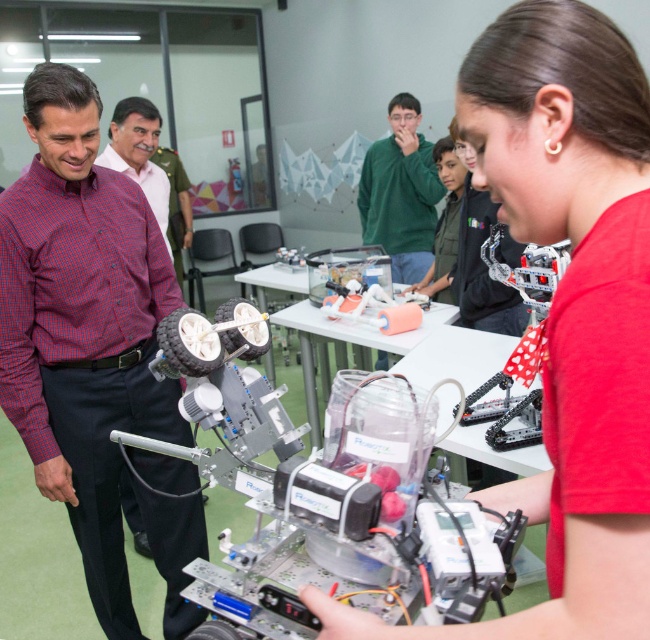
From the picture: You are a visitor observing the robotics activity. You notice two people in the scene wearing the red checkered shirt at left and the green matte sweater at center. Which person is closer to the robot?

The red checkered shirt at left is shorter than the green matte sweater at center, so the person wearing the red checkered shirt at left is closer to the robot.

You are a student in the classroom and need to decide which clothing item is taller between the green matte sweater at center and the plaid shirt at left. Which one should you choose?

The green matte sweater at center is taller than the plaid shirt at left, so you should choose the green matte sweater at center.

You are a student in the classroom and need to determine which clothing item is wider between the red checkered shirt at left and the green matte sweater at center. Which one is wider?

The green matte sweater at center is wider than the red checkered shirt at left.